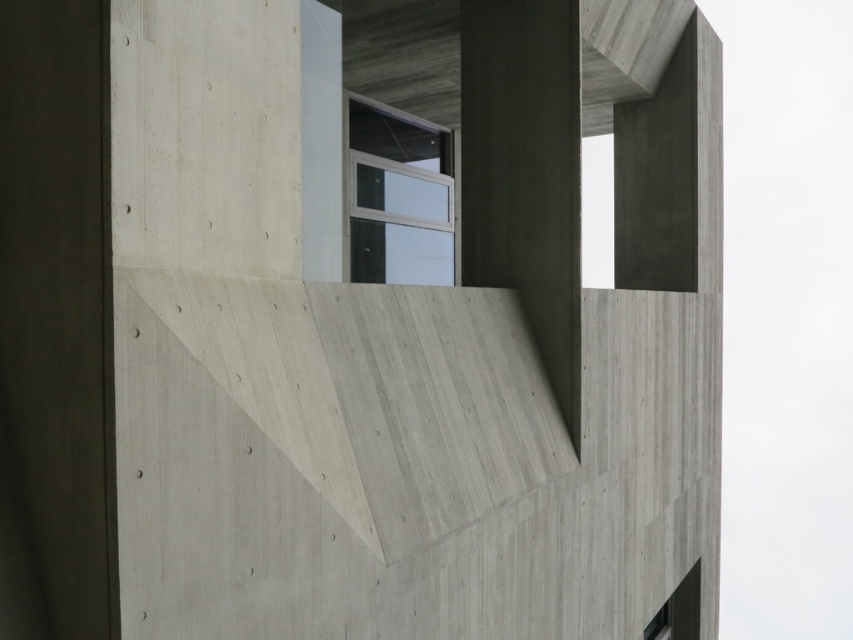
You are an architect designing a new building and want to ensure that the clear glass window at center and the matte glass window at lower right are proportionally balanced. Given their heights, which window should be placed in a position where height is more critical for structural integrity?

The clear glass window at center has a greater height, so it should be placed in positions where structural integrity requires a taller window, such as supporting upper floors or allowing more natural light.

You are an architect analyzing the structural integrity of the building. You notice the gray concrete at center and the matte glass window at lower right. Which material component is larger in size?

The gray concrete at center is bigger than the matte glass window at lower right, so the gray concrete at center is the larger component.

Is the clear glass window at center located at point (x=398, y=195)?

Yes, the clear glass window at center is located at point (x=398, y=195).